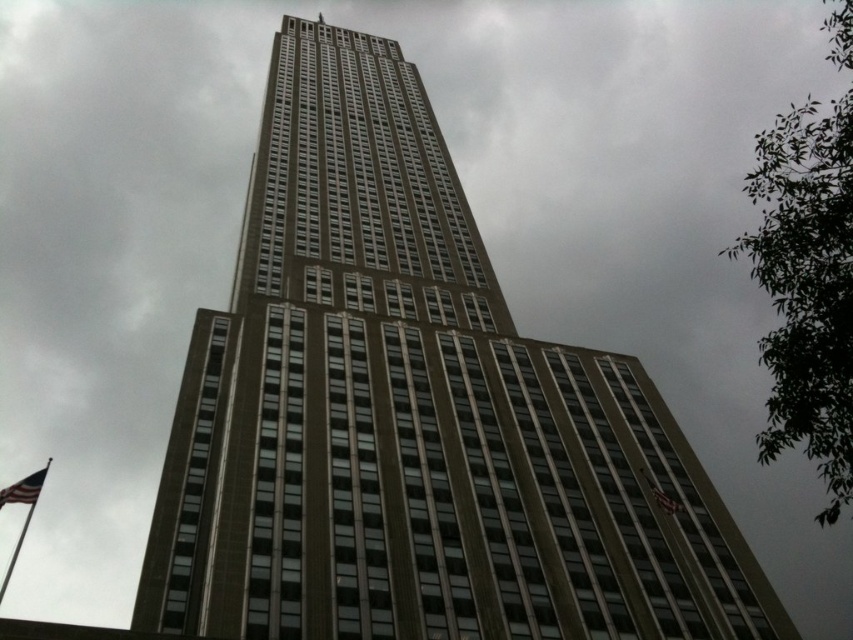
Is point (41, 472) positioned before point (33, 490)?

No.

Locate an element on the screen. The width and height of the screenshot is (853, 640). metallic flag pole at lower left is located at coordinates (27, 509).